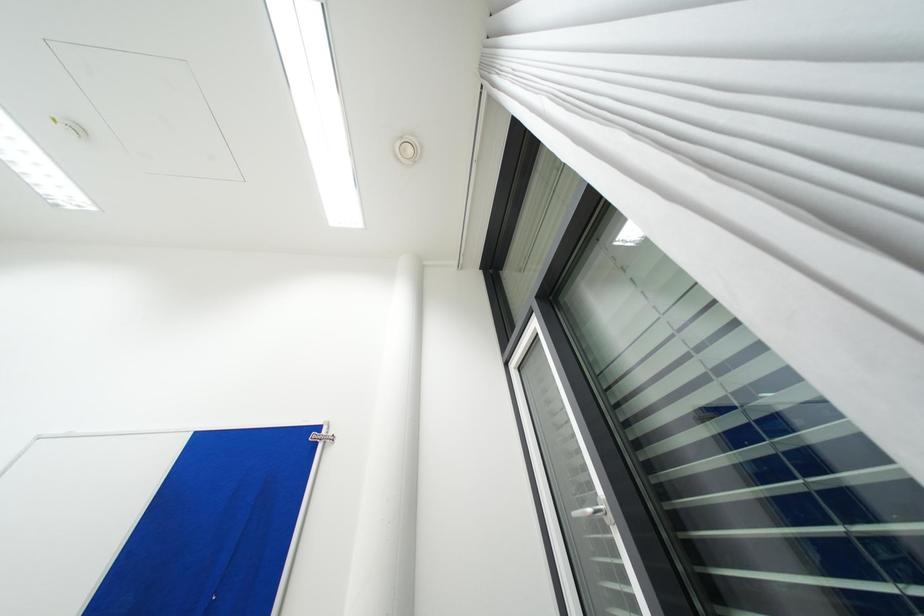
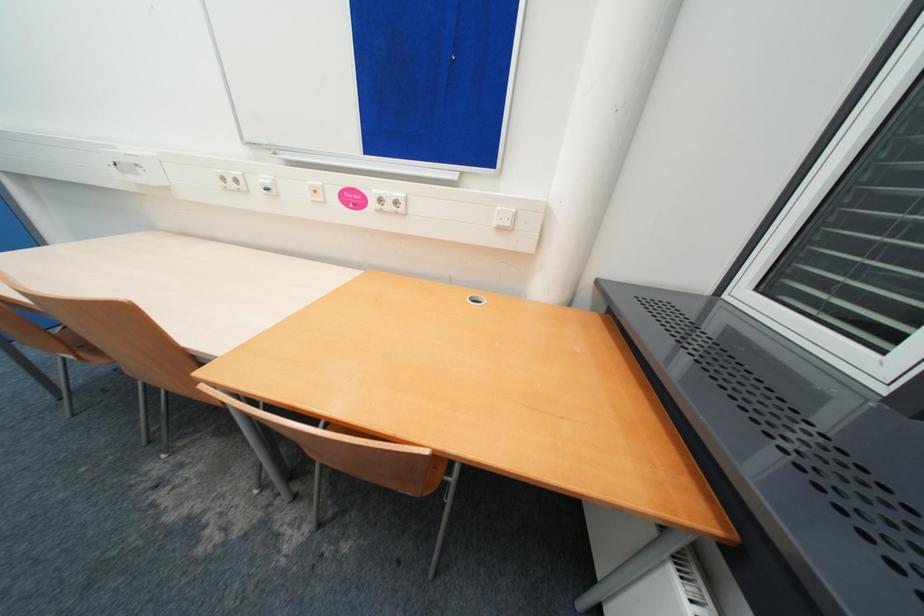
The first image is from the beginning of the video and the second image is from the end. How did the camera likely rotate when shooting the video?

The camera rotated toward left-down.